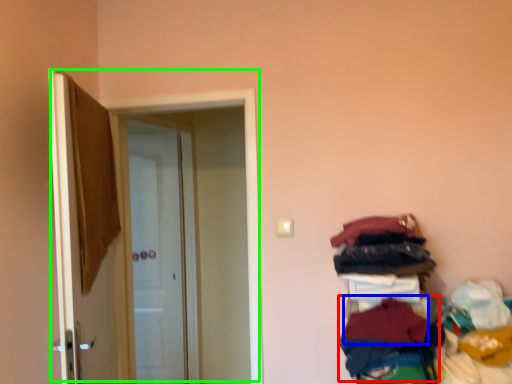
Question: Which is nearer to the clothing (highlighted by a red box)? clothing (highlighted by a blue box) or door (highlighted by a green box).

Choices:
 (A) clothing
 (B) door

Answer: (A)